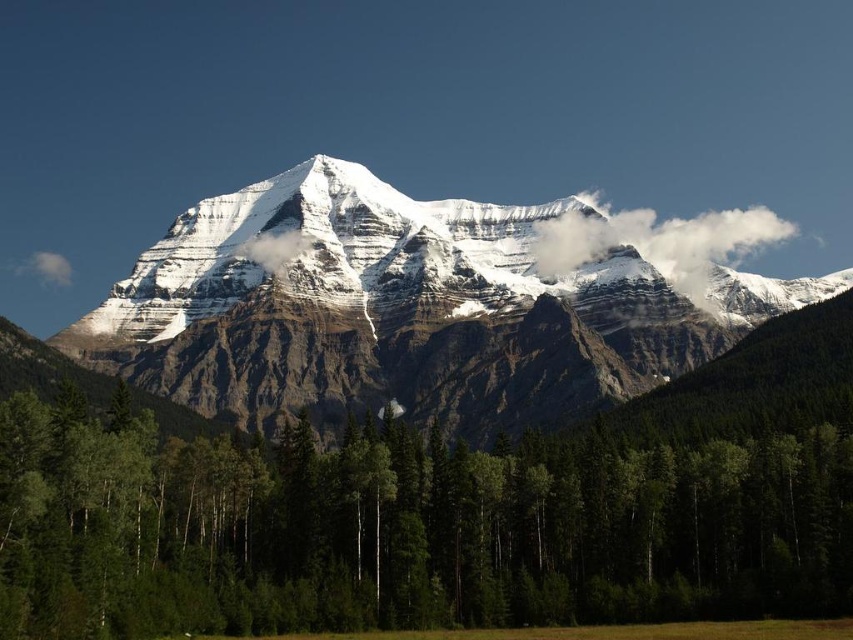
Question: Estimate the real-world distances between objects in this image. Which object is closer to the snowy granite mountain range at center?

Choices:
 (A) green matte tree at center
 (B) white fluffy cloud at upper right

Answer: (B)

Question: Is green matte tree at center thinner than snowy granite mountain range at center?

Choices:
 (A) yes
 (B) no

Answer: (A)

Question: Which of the following is the closest to the observer?

Choices:
 (A) (558, 256)
 (B) (550, 300)
 (C) (450, 525)

Answer: (C)

Question: From the image, what is the correct spatial relationship of green matte tree at center in relation to white fluffy cloud at upper right?

Choices:
 (A) right
 (B) left

Answer: (B)

Question: Where is green matte tree at center located in relation to snowy granite mountain range at center in the image?

Choices:
 (A) left
 (B) right

Answer: (A)

Question: Among these points, which one is farthest from the camera?

Choices:
 (A) (21, 531)
 (B) (247, 307)
 (C) (624, 227)

Answer: (C)